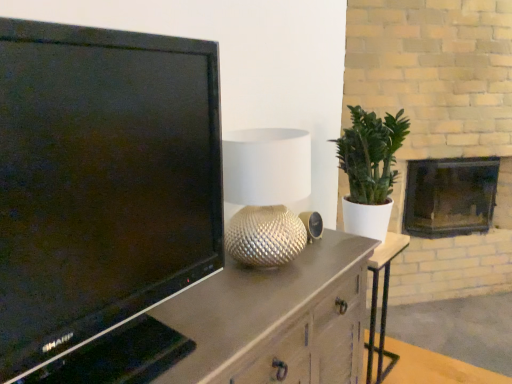
Find the location of `vacant region under metallic silver side table at center (from a real-world perspective)`. vacant region under metallic silver side table at center (from a real-world perspective) is located at coordinates (377, 366).